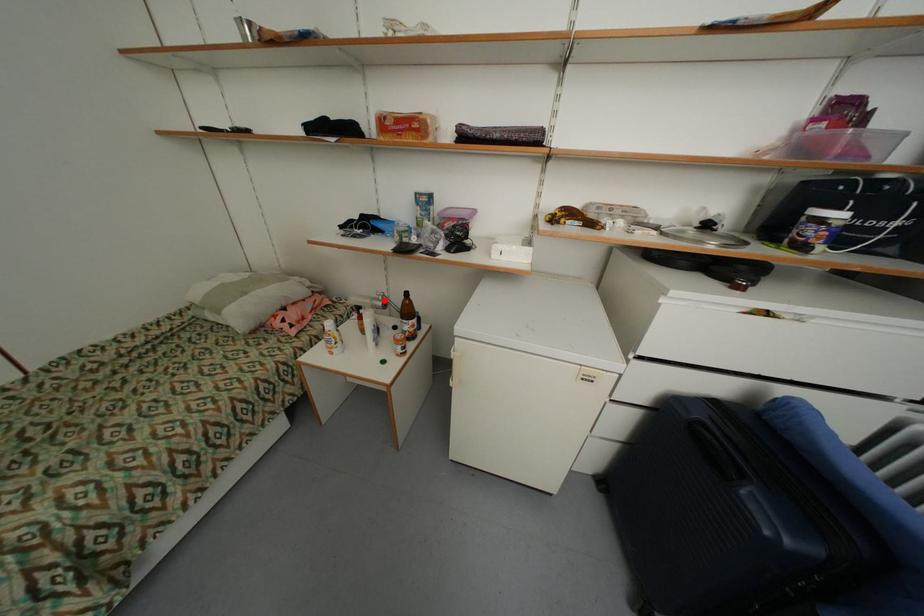
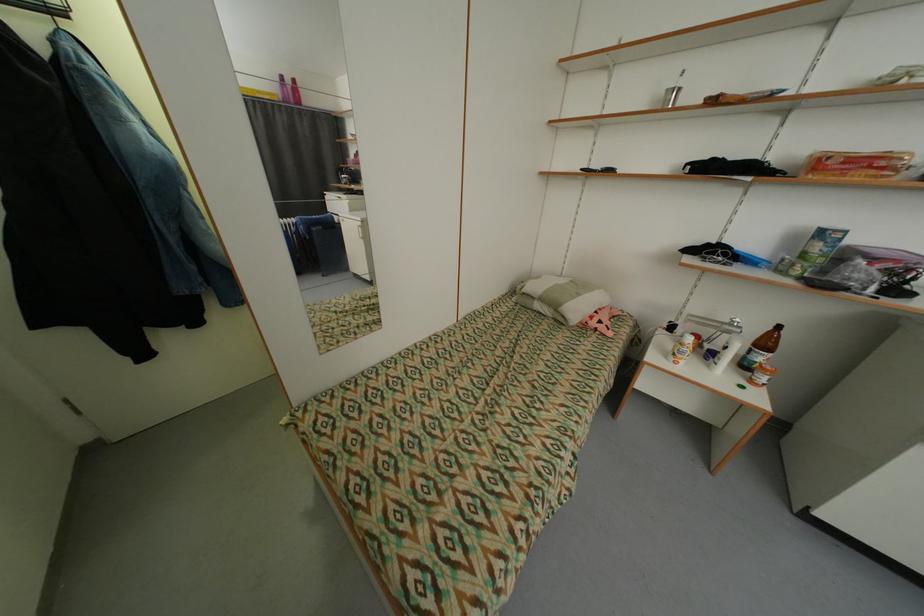
The point at the highlighted location is marked in the first image. Where is the corresponding point in the second image?

(736, 326)